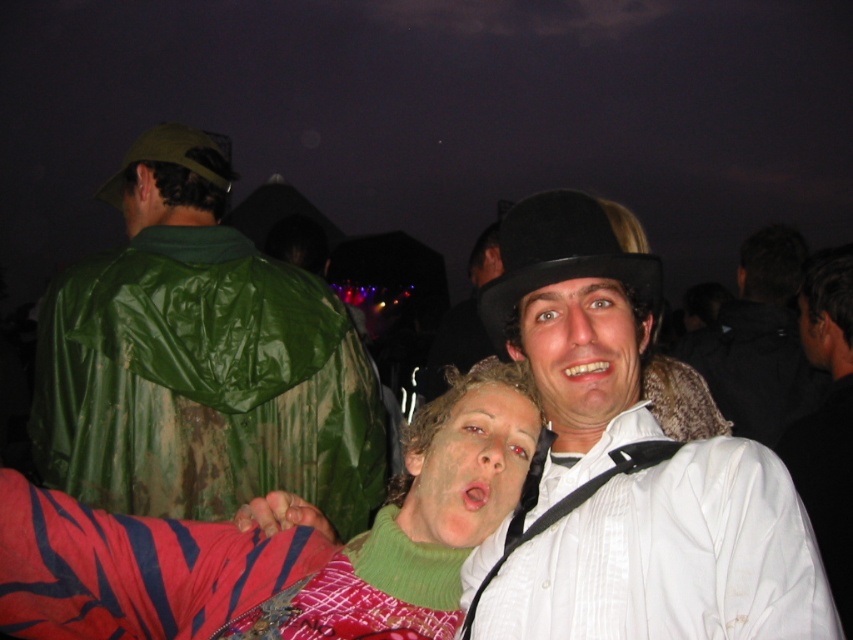
You are organizing a costume party and need to know which hat takes up more space for storage. Based on the image, which hat between the black felt bowler hat at upper center and the green fabric hat at upper left requires more storage space?

The green fabric hat at upper left requires more storage space because it occupies more space than the black felt bowler hat at upper center.

You are planning to wear a hat that is 12 inches wide. Looking at the image, can you determine which hat between the black felt bowler hat at upper center and the green fabric hat at upper left would fit your head size?

The black felt bowler hat at upper center has a width less than the green fabric hat at upper left. Since your head requires a 12 inch wide hat, you should choose the green fabric hat at upper left as it is wider.

You are a photographer trying to capture the exact location of the white matte bowler hat at upper center in the image. According to the coordinates provided, where would you focus your camera lens to ensure the hat is centered in your shot?

The white matte bowler hat at upper center is located at coordinates point (625, 468), so you should focus your camera lens at that point to center the hat in your shot.